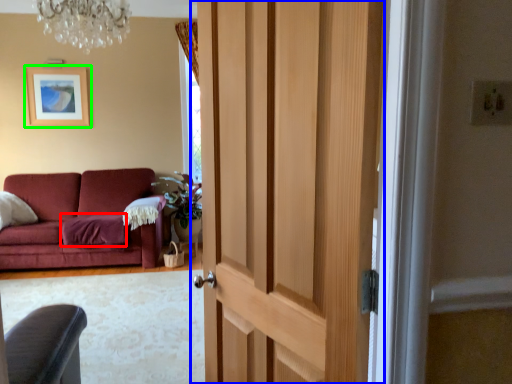
Question: Which object is the closest to the blanket (highlighted by a red box)? Choose among these: door (highlighted by a blue box) or picture frame (highlighted by a green box).

Choices:
 (A) door
 (B) picture frame

Answer: (B)